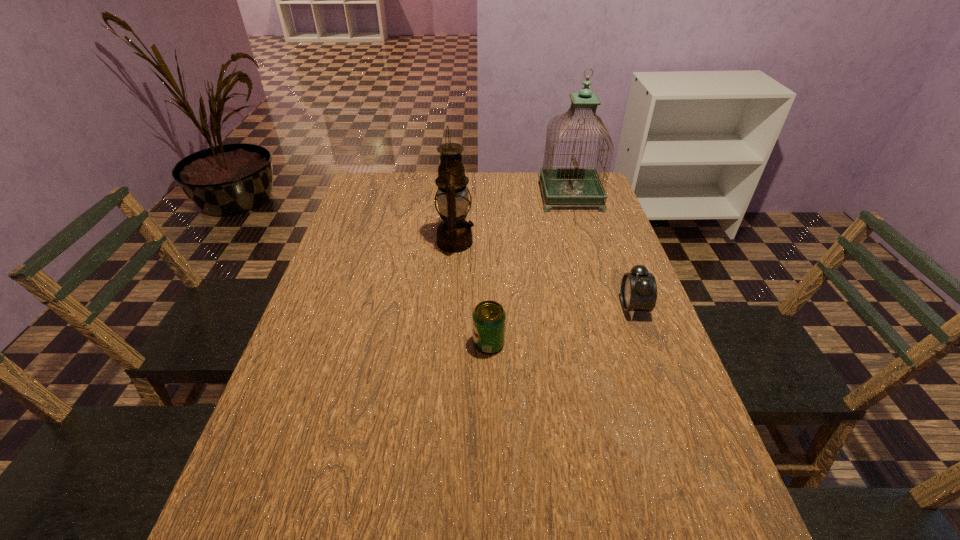
Where is `birdcage`? The width and height of the screenshot is (960, 540). birdcage is located at coordinates (563, 186).

The height and width of the screenshot is (540, 960). Find the location of `the tallest object`. the tallest object is located at coordinates (563, 186).

Locate an element on the screen. The height and width of the screenshot is (540, 960). the second tallest object is located at coordinates (454, 234).

Locate an element on the screen. the third nearest object is located at coordinates (454, 234).

The image size is (960, 540). I want to click on alarm clock, so click(x=638, y=292).

Identify the location of the nearest object. (489, 317).

The image size is (960, 540). What are the coordinates of `the second object from left to right` in the screenshot? It's located at tap(489, 317).

Locate an element on the screen. Image resolution: width=960 pixels, height=540 pixels. vacant position located 0.180m at the door of the farthest object is located at coordinates (491, 197).

The height and width of the screenshot is (540, 960). I want to click on vacant area situated at the door of the farthest object, so click(x=504, y=197).

Where is `free space located at the door of the farthest object`? The image size is (960, 540). free space located at the door of the farthest object is located at coordinates (476, 197).